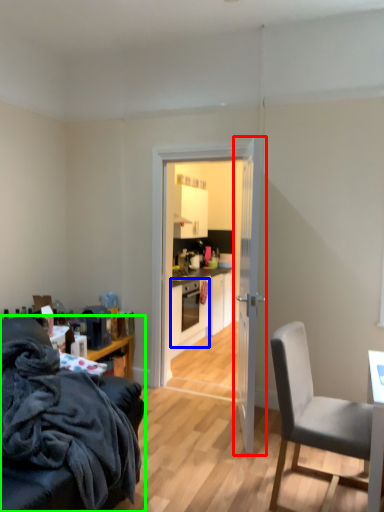
Question: Which object is positioned farthest from door (highlighted by a red box)? Select from oven (highlighted by a blue box) and chair (highlighted by a green box).

Choices:
 (A) oven
 (B) chair

Answer: (A)